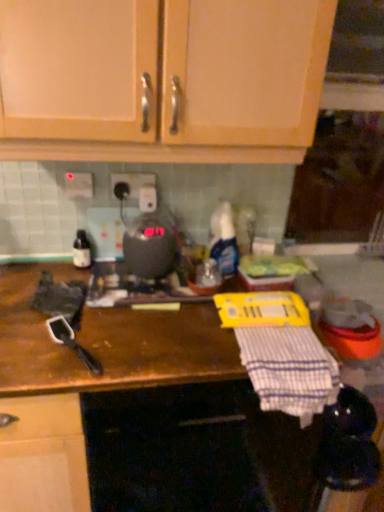
Question: Considering the positions of white plastic electric outlet at upper center, arranged as the 2th electric outlet when viewed from the right, and translucent plastic spray bottle at center, acting as the second bottle starting from the left, in the image, is white plastic electric outlet at upper center, arranged as the 2th electric outlet when viewed from the right, taller or shorter than translucent plastic spray bottle at center, acting as the second bottle starting from the left,?

Choices:
 (A) short
 (B) tall

Answer: (A)

Question: Does point (69, 174) appear closer or farther from the camera than point (210, 227)?

Choices:
 (A) closer
 (B) farther

Answer: (A)

Question: Which of these objects is positioned closest to the translucent plastic spray bottle at center, the 1th bottle when ordered from right to left?

Choices:
 (A) white checkered cloth at lower right
 (B) brown wooden countertop at center
 (C) matte glass bottle at left, the 1th bottle viewed from the left
 (D) metallic gray toaster at center
 (E) white plastic electric outlet at upper center, arranged as the 2th electric outlet when viewed from the right

Answer: (D)

Question: Which object is the closest to the white plastic electric outlet at upper center, the 1th electric outlet positioned from the left?

Choices:
 (A) white plastic electric outlet at center, the 1th electric outlet in the right-to-left sequence
 (B) wooden cabinet doors at upper center
 (C) brown wooden countertop at center
 (D) matte glass bottle at left, which is the second bottle in right-to-left order
 (E) translucent plastic spray bottle at center, the 1th bottle when ordered from right to left

Answer: (A)